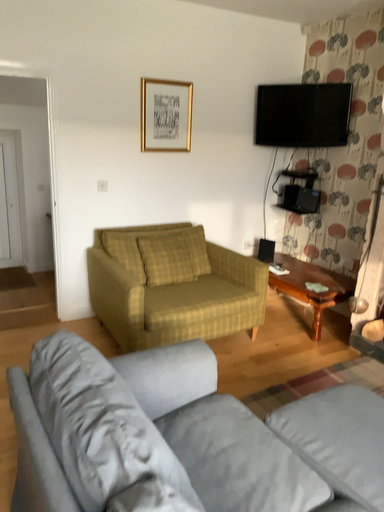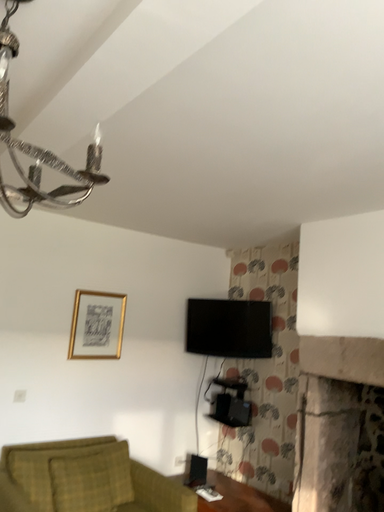
Question: How did the camera likely rotate when shooting the video?

Choices:
 (A) rotated left
 (B) rotated right

Answer: (B)